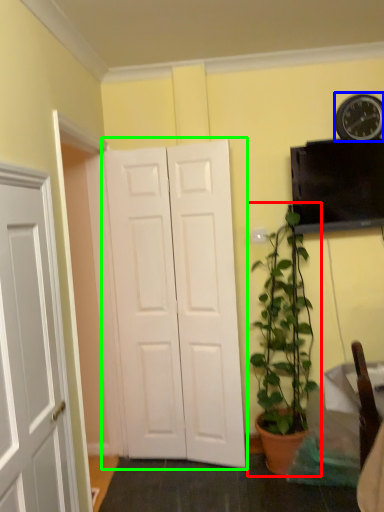
Question: Which object is positioned farthest from houseplant (highlighted by a red box)? Select from clock (highlighted by a blue box) and door (highlighted by a green box).

Choices:
 (A) clock
 (B) door

Answer: (A)